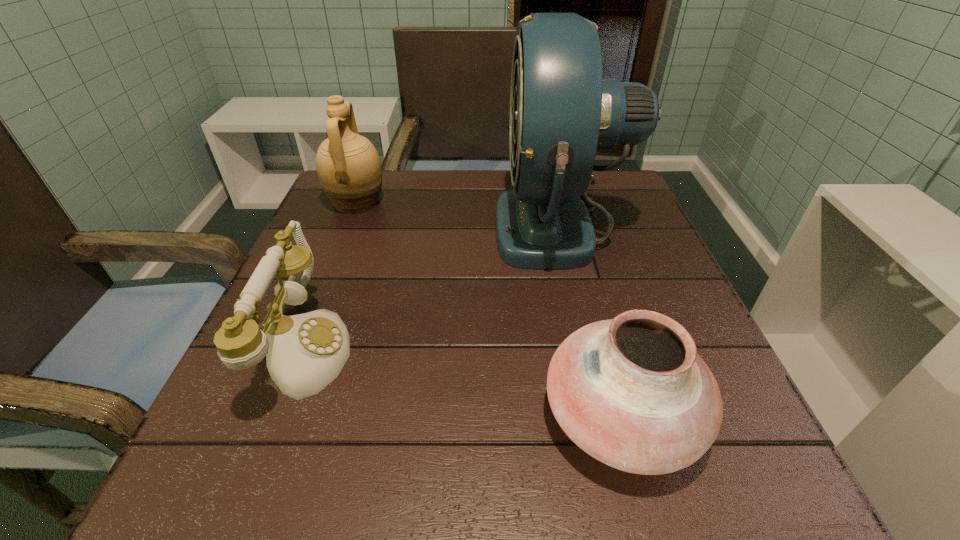
This screenshot has height=540, width=960. Find the location of `fan present at the far edge`. fan present at the far edge is located at coordinates (562, 111).

Find the location of a particular element. pitcher at the far edge is located at coordinates (349, 168).

Locate an element on the screen. object located at the near edge is located at coordinates (632, 392).

This screenshot has width=960, height=540. What are the coordinates of `pitcher that is positioned at the left edge` in the screenshot? It's located at (349, 168).

Image resolution: width=960 pixels, height=540 pixels. Find the location of `telephone located at the left edge`. telephone located at the left edge is located at coordinates (304, 353).

The image size is (960, 540). What are the coordinates of `fan that is at the right edge` in the screenshot? It's located at (562, 111).

Identify the location of pottery that is at the right edge. (632, 392).

The width and height of the screenshot is (960, 540). I want to click on object present at the far left corner, so [349, 168].

At what (x,y) coordinates should I click in order to perform the action: click on object that is at the far right corner. Please return your answer as a coordinate pair (x, y). The height and width of the screenshot is (540, 960). Looking at the image, I should click on (562, 111).

You are a GUI agent. You are given a task and a screenshot of the screen. Output one action in this format:
    pyautogui.click(x=<x>, y=<y>)
    Task: Click on the object positioned at the near right corner
    This screenshot has height=540, width=960.
    Given the screenshot: What is the action you would take?
    pyautogui.click(x=632, y=392)